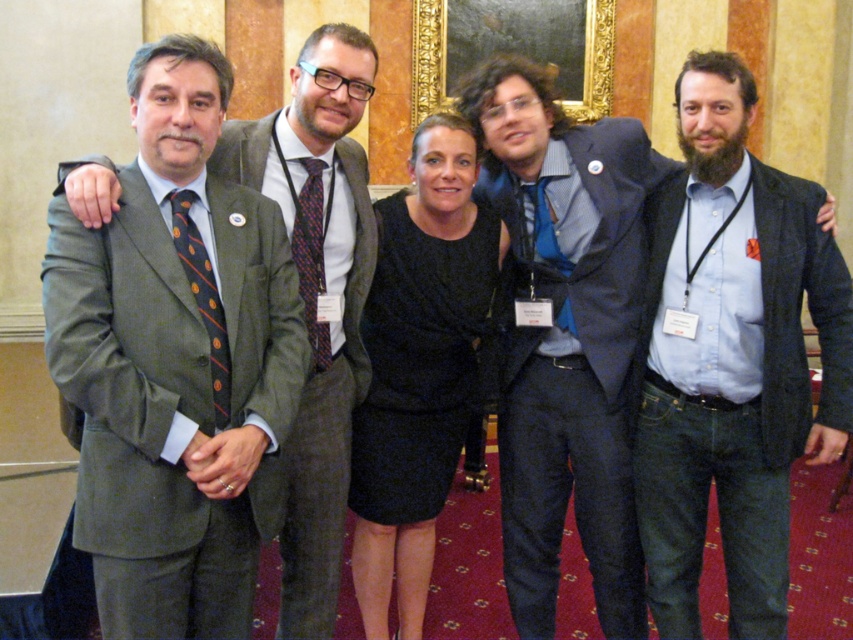
Which is above, blue denim jeans at right or green striped tie at left?

green striped tie at left is higher up.

Can you confirm if blue denim jeans at right is thinner than green striped tie at left?

No.

Which is in front, point (804, 444) or point (222, 321)?

Point (222, 321) is in front.

Image resolution: width=853 pixels, height=640 pixels. Find the location of `blue denim jeans at right`. blue denim jeans at right is located at coordinates (734, 401).

Who is lower down, black satin dress at center or matte green suit at left?

black satin dress at center is below.

Is black satin dress at center thinner than matte green suit at left?

In fact, black satin dress at center might be wider than matte green suit at left.

Is point (421, 385) positioned before point (300, 595)?

No, (421, 385) is further to viewer.

I want to click on black satin dress at center, so click(418, 368).

Between matte green suit at left and patterned silk tie at center, which one appears on the right side from the viewer's perspective?

patterned silk tie at center is more to the right.

Between point (318, 90) and point (311, 186), which one is positioned in front?

Point (318, 90) is in front.

Who is more forward, (358, 307) or (318, 250)?

Point (318, 250) is more forward.

Image resolution: width=853 pixels, height=640 pixels. What are the coordinates of `matte green suit at left` in the screenshot? It's located at (318, 300).